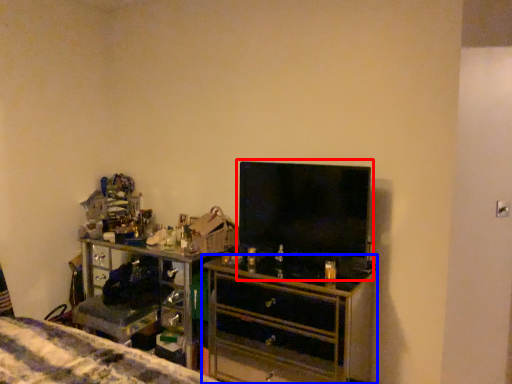
Question: Which point is closer to the camera, tv show (highlighted by a red box) or chest of drawers (highlighted by a blue box)?

Choices:
 (A) tv show
 (B) chest of drawers

Answer: (B)